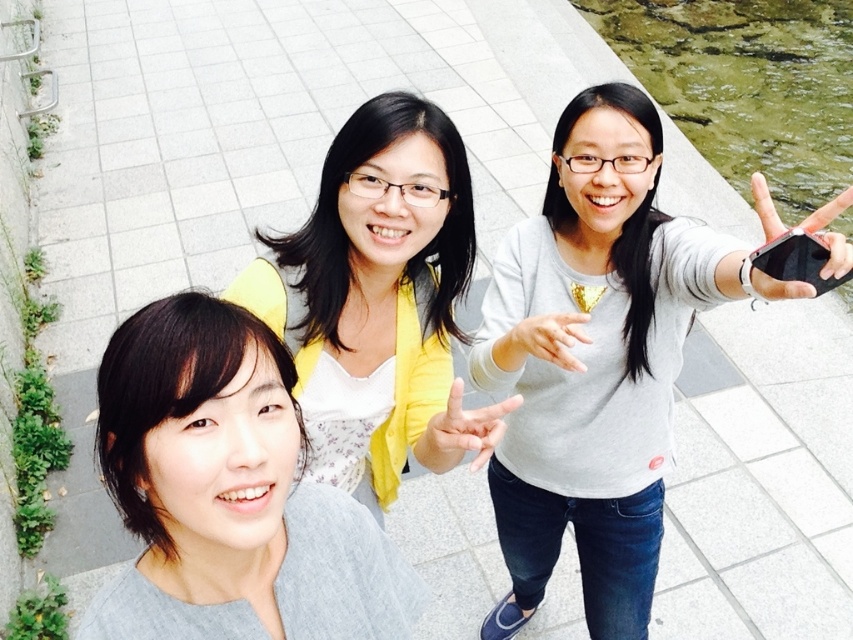
You are holding a camera and want to take a photo of the gray matte shirt at lower left. The camera has a minimum focusing distance of 36 inches. Can you take the photo without moving closer?

The gray matte shirt at lower left and camera are 36.37 inches apart from each other. Since the minimum focusing distance is 36 inches, you can take the photo without moving closer.

You are a photographer trying to capture a candid shot of the two people in the scene. You notice the matte yellow cardigan at center and the matte yellow hand at center. Which one is covering the other?

The matte yellow cardigan at center is positioned over the matte yellow hand at center, so the cardigan is covering the hand.

What is located at the coordinates point (228, 493)?

The gray matte shirt at lower left is located at point (228, 493).